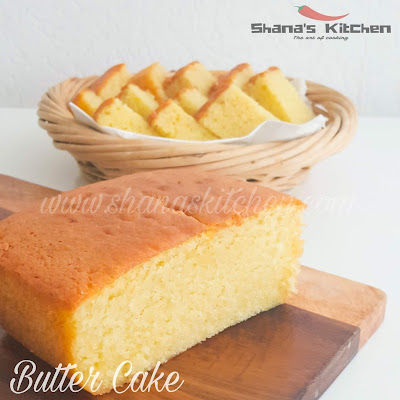
Locate an element on the screen. white napkin underneath cake slices" is located at coordinates (269, 134).